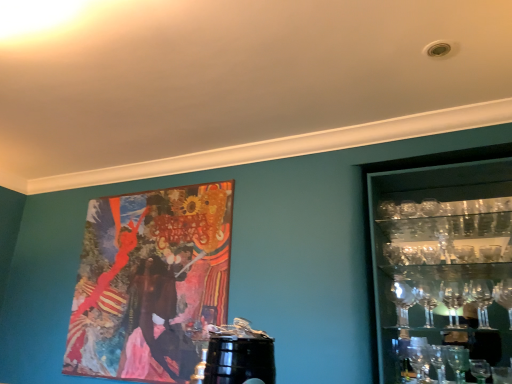
Question: Considering the relative positions of clear glass shelves at right and wooden painting at upper left in the image provided, is clear glass shelves at right to the left of wooden painting at upper left from the viewer's perspective?

Choices:
 (A) yes
 (B) no

Answer: (B)

Question: Does clear glass shelves at right have a lesser height compared to wooden painting at upper left?

Choices:
 (A) no
 (B) yes

Answer: (B)

Question: Does clear glass shelves at right have a smaller size compared to wooden painting at upper left?

Choices:
 (A) yes
 (B) no

Answer: (B)

Question: From the image's perspective, is clear glass shelves at right above wooden painting at upper left?

Choices:
 (A) yes
 (B) no

Answer: (A)

Question: Is clear glass shelves at right bigger than wooden painting at upper left?

Choices:
 (A) yes
 (B) no

Answer: (A)

Question: Is clear glass shelves at right facing towards wooden painting at upper left?

Choices:
 (A) no
 (B) yes

Answer: (A)

Question: Considering the relative sizes of wooden painting at upper left and clear glass shelves at right in the image provided, is wooden painting at upper left taller than clear glass shelves at right?

Choices:
 (A) yes
 (B) no

Answer: (A)

Question: Is wooden painting at upper left facing towards clear glass shelves at right?

Choices:
 (A) no
 (B) yes

Answer: (A)

Question: From the image's perspective, is wooden painting at upper left below clear glass shelves at right?

Choices:
 (A) yes
 (B) no

Answer: (A)

Question: Can we say wooden painting at upper left lies outside clear glass shelves at right?

Choices:
 (A) no
 (B) yes

Answer: (B)

Question: Does wooden painting at upper left have a larger size compared to clear glass shelves at right?

Choices:
 (A) no
 (B) yes

Answer: (A)

Question: Can you confirm if wooden painting at upper left is positioned to the right of clear glass shelves at right?

Choices:
 (A) yes
 (B) no

Answer: (B)

Question: Considering the positions of wooden painting at upper left and clear glass shelves at right in the image, is wooden painting at upper left taller or shorter than clear glass shelves at right?

Choices:
 (A) short
 (B) tall

Answer: (B)